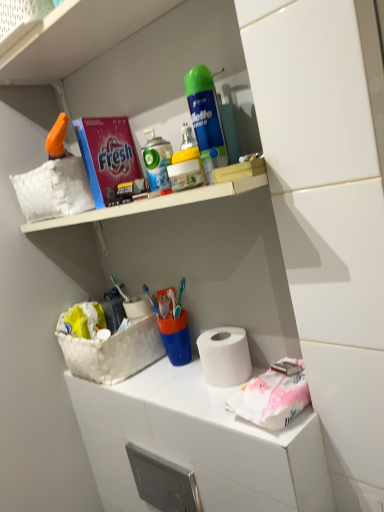
In order to click on vacant space that is to the left of white matte paper towel at center in this screenshot , I will do `click(174, 394)`.